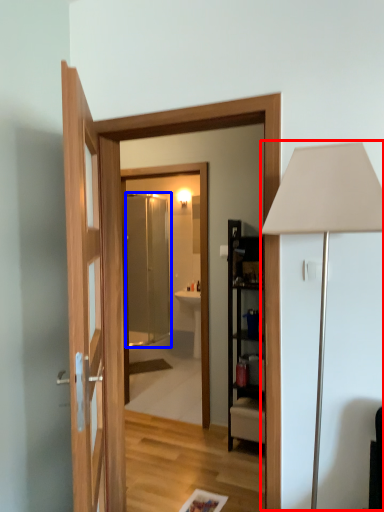
Question: Which object appears closest to the camera in this image, table lamp (highlighted by a red box) or screen door (highlighted by a blue box)?

Choices:
 (A) table lamp
 (B) screen door

Answer: (A)